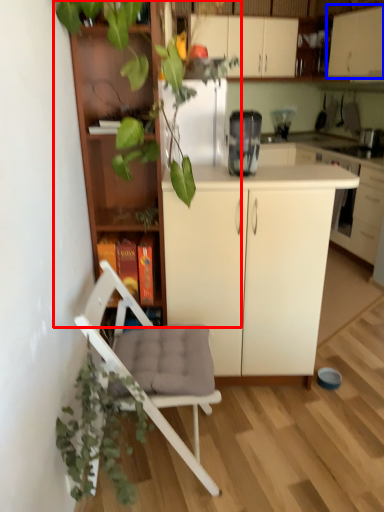
Question: Which of the following is the closest to the observer, houseplant (highlighted by a red box) or cabinetry (highlighted by a blue box)?

Choices:
 (A) houseplant
 (B) cabinetry

Answer: (A)